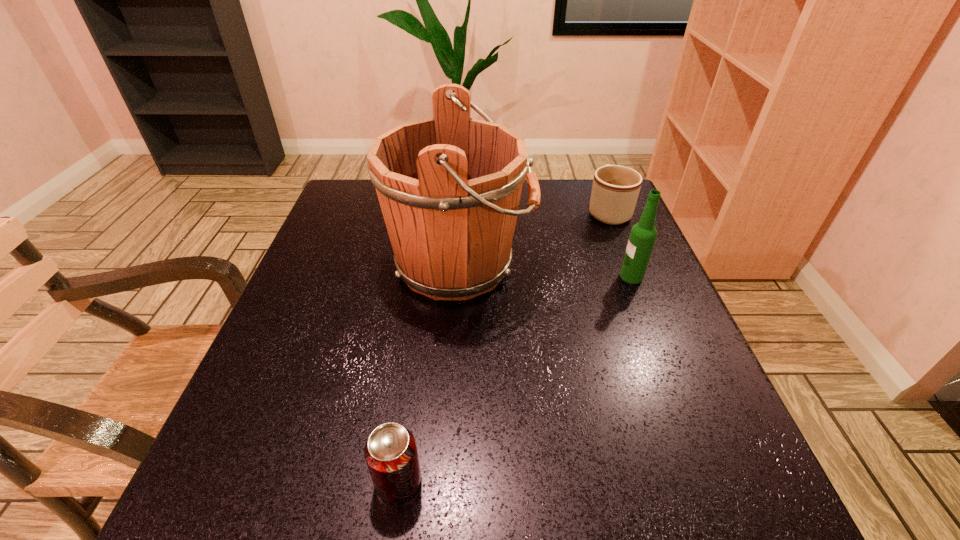
This screenshot has height=540, width=960. I want to click on free space that is in between the beer bottle and the tallest object, so click(546, 270).

Choose which object is the nearest neighbor to the soda can. Please provide its 2D coordinates. Your answer should be formatted as a tuple, i.e. [(x, y)], where the tuple contains the x and y coordinates of a point satisfying the conditions above.

[(449, 187)]

Find the location of a particular element. object that stands as the third closest to the mug is located at coordinates (390, 452).